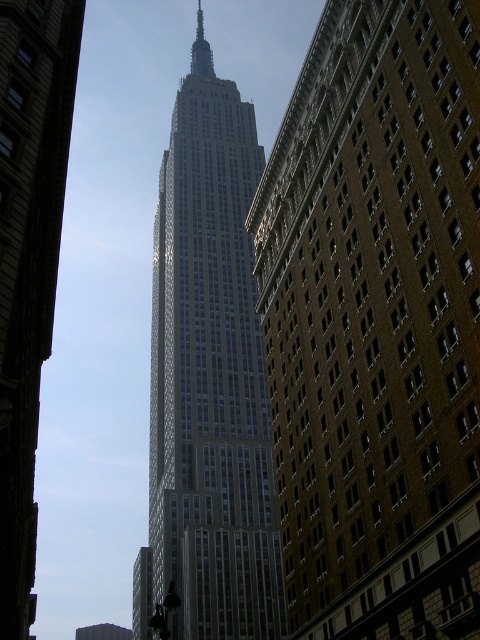
You are a tourist standing at the base of the Empire State Building and want to take a photo that includes both the brick building at center and the glassy steel skyscraper at center. Which one will appear taller in the photo?

The glassy steel skyscraper at center will appear taller in the photo because it is taller than the brick building at center according to the description.

You are standing in the middle of the street looking at the Empire State Building and the brick building next to it. Which building is closer to you, the brick building at center or the glassy steel skyscraper at center?

The brick building at center is closer to you than the glassy steel skyscraper at center because the glassy steel skyscraper at center is positioned behind the brick building at center.